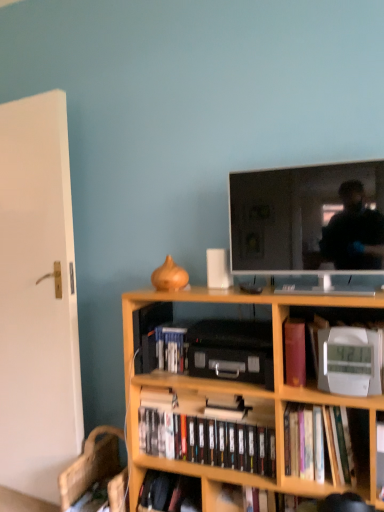
Question: Is purple matte bookshelf at center, the fourth book positioned from the bottom, surrounding flat screen tv at upper center?

Choices:
 (A) no
 (B) yes

Answer: (A)

Question: Is purple matte bookshelf at center, the fourth book positioned from the bottom, wider than flat screen tv at upper center?

Choices:
 (A) yes
 (B) no

Answer: (B)

Question: Does purple matte bookshelf at center, positioned as the second book in top-to-bottom order, touch flat screen tv at upper center?

Choices:
 (A) no
 (B) yes

Answer: (A)

Question: Does purple matte bookshelf at center, the fourth book positioned from the bottom, have a lesser width compared to flat screen tv at upper center?

Choices:
 (A) no
 (B) yes

Answer: (B)

Question: Is purple matte bookshelf at center, the fourth book positioned from the bottom, turned away from flat screen tv at upper center?

Choices:
 (A) no
 (B) yes

Answer: (A)

Question: From the image's perspective, relative to purple matte bookshelf at center, positioned as the second book in top-to-bottom order, is hardcover book at lower center, arranged as the first book when ordered from the bottom, above or below?

Choices:
 (A) below
 (B) above

Answer: (A)

Question: Considering the positions of hardcover book at lower center, arranged as the first book when ordered from the bottom, and purple matte bookshelf at center, positioned as the second book in top-to-bottom order, in the image, is hardcover book at lower center, arranged as the first book when ordered from the bottom, bigger or smaller than purple matte bookshelf at center, positioned as the second book in top-to-bottom order,?

Choices:
 (A) big
 (B) small

Answer: (A)

Question: Is hardcover book at lower center, the 5th book from the top, spatially inside purple matte bookshelf at center, positioned as the second book in top-to-bottom order, or outside of it?

Choices:
 (A) inside
 (B) outside

Answer: (B)

Question: In terms of width, does hardcover book at lower center, the 5th book from the top, look wider or thinner when compared to purple matte bookshelf at center, the fourth book positioned from the bottom?

Choices:
 (A) thin
 (B) wide

Answer: (B)

Question: From the image's perspective, is white plastic clock at lower right, the fifth book when ordered from bottom to top, above or below black matte dvds at center, marked as the 2th book in a bottom-to-top arrangement?

Choices:
 (A) below
 (B) above

Answer: (B)

Question: In the image, is white plastic clock at lower right, the fifth book when ordered from bottom to top, on the left side or the right side of black matte dvds at center, the fourth book in the top-to-bottom sequence?

Choices:
 (A) right
 (B) left

Answer: (A)

Question: Considering the positions of white plastic clock at lower right, arranged as the 1th book when viewed from the top, and black matte dvds at center, the fourth book in the top-to-bottom sequence, in the image, is white plastic clock at lower right, arranged as the 1th book when viewed from the top, taller or shorter than black matte dvds at center, the fourth book in the top-to-bottom sequence,?

Choices:
 (A) short
 (B) tall

Answer: (B)

Question: Does point (360, 333) appear closer or farther from the camera than point (145, 413)?

Choices:
 (A) farther
 (B) closer

Answer: (B)

Question: In terms of height, does flat screen tv at upper center look taller or shorter compared to wooden computer chair at lower left?

Choices:
 (A) tall
 (B) short

Answer: (A)

Question: Is flat screen tv at upper center situated inside wooden computer chair at lower left or outside?

Choices:
 (A) outside
 (B) inside

Answer: (A)